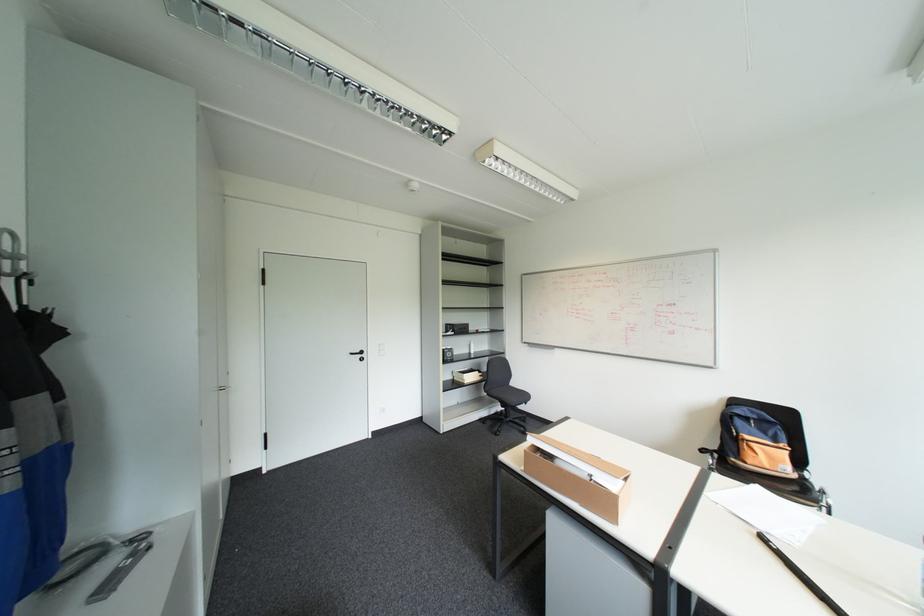
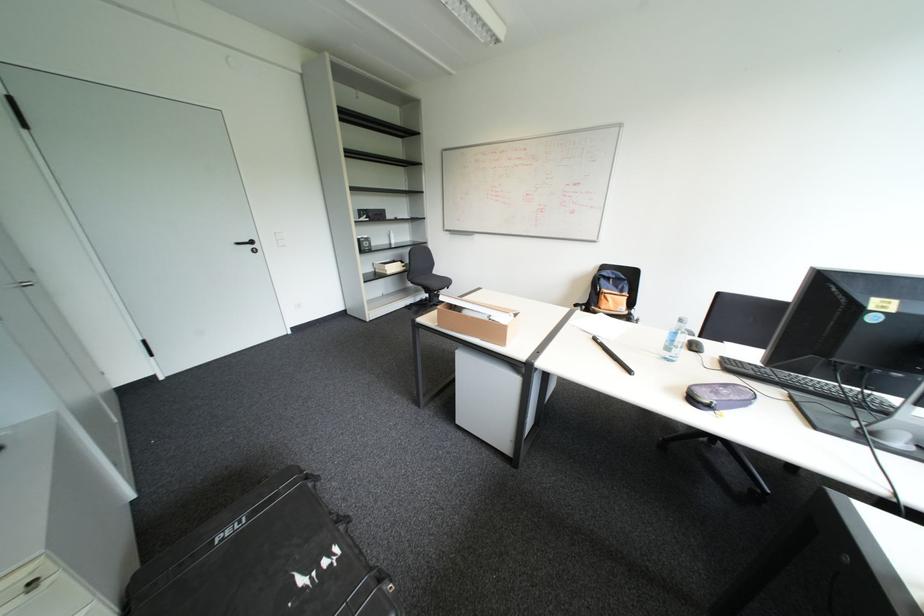
Question: The images are taken continuously from a first-person perspective. In which direction are you moving?

Choices:
 (A) Left
 (B) Right
 (C) Forward
 (D) Backward

Answer: (B)